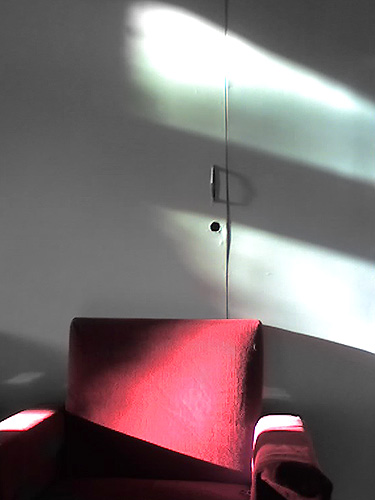
At what (x,y) coordinates should I click in order to perform the action: click on wall. Please return your answer as a coordinate pair (x, y). This screenshot has width=375, height=500. Looking at the image, I should click on (131, 286).